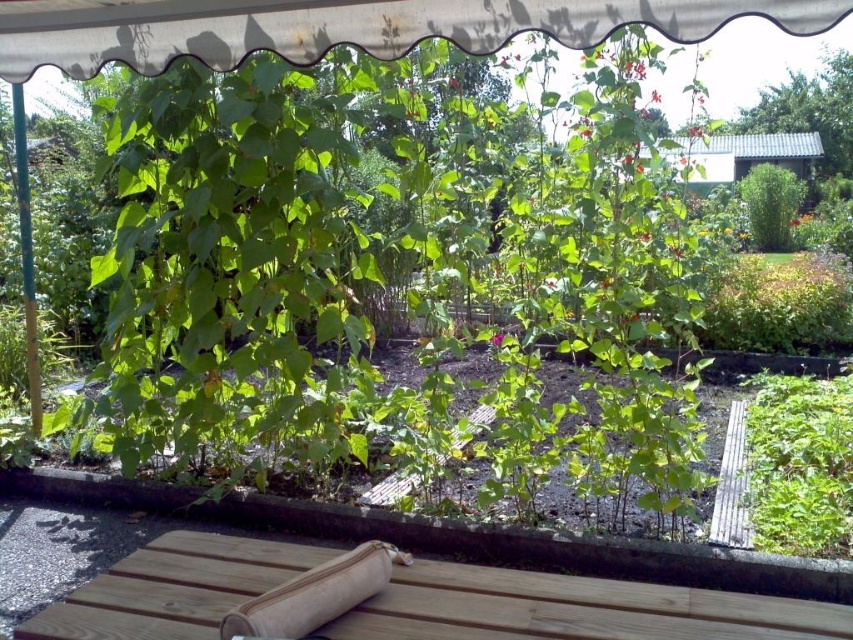
Question: Can you confirm if natural wood picnic table at lower center is positioned below beige fabric rolling pin at lower center?

Choices:
 (A) yes
 (B) no

Answer: (A)

Question: Which object is positioned closest to the natural wood picnic table at lower center?

Choices:
 (A) beige fabric rolling pin at lower center
 (B) green leafy plant at center

Answer: (A)

Question: Does natural wood picnic table at lower center have a larger size compared to green leafy plant at center?

Choices:
 (A) yes
 (B) no

Answer: (B)

Question: Which of the following is the farthest from the observer?

Choices:
 (A) beige fabric rolling pin at lower center
 (B) natural wood picnic table at lower center
 (C) green leafy plant at center

Answer: (C)

Question: Which of the following is the farthest from the observer?

Choices:
 (A) green leafy plant at center
 (B) natural wood picnic table at lower center

Answer: (A)

Question: Does natural wood picnic table at lower center appear on the left side of green leafy plant at center?

Choices:
 (A) no
 (B) yes

Answer: (B)